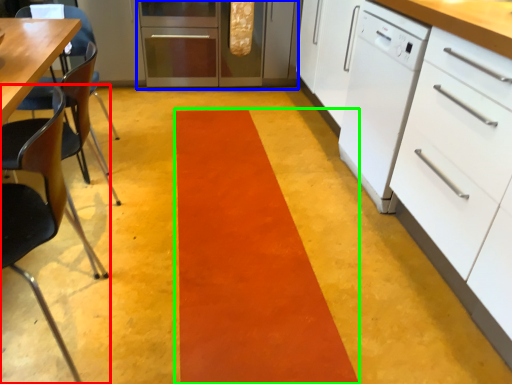
Question: Which object is positioned closest to chair (highlighted by a red box)? Select from kitchen appliance (highlighted by a blue box) and strip (highlighted by a green box).

Choices:
 (A) kitchen appliance
 (B) strip

Answer: (B)